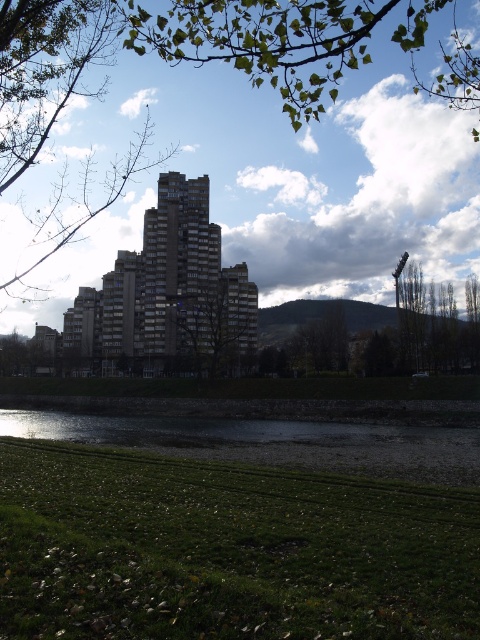
You are standing at the edge of the green grass at lower center and want to see the top of the green leafy tree at center. Can you see it without any obstruction?

The green grass at lower center is shorter than the green leafy tree at center, so yes, you can see the top of the green leafy tree at center as it is taller than the grass.

You are a gardener planning to mow the green grass at lower center and the green grassy bank at lower center. Which area requires a shorter blade setting on the lawnmower to achieve the desired height?

The green grass at lower center requires a shorter blade setting since it has a lesser height compared to the green grassy bank at lower center.